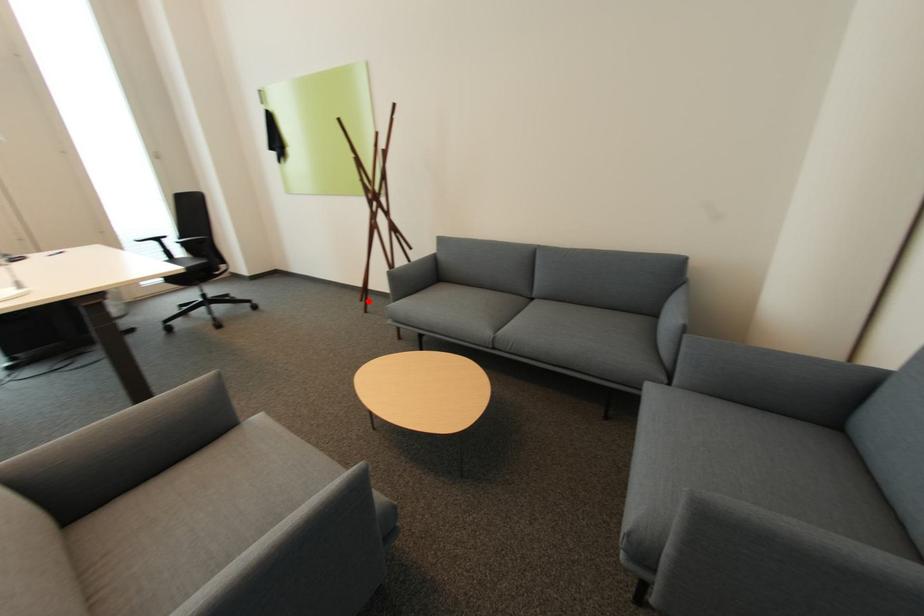
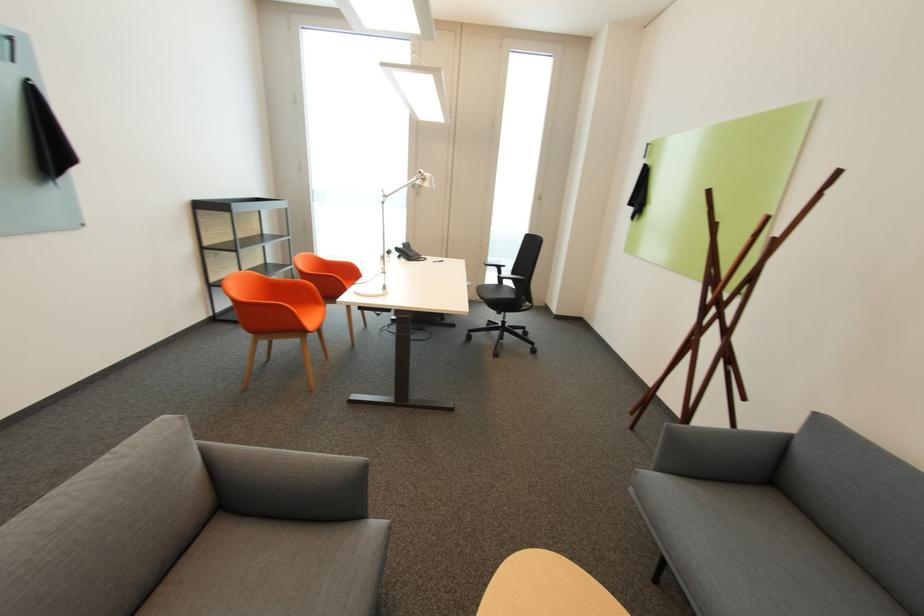
Question: A red point is marked in image1. In image2, is the corresponding 3D point closer to the camera or farther? Reply with the corresponding letter.

Choices:
 (A) The corresponding 3D point is closer.
 (B) The corresponding 3D point is farther.

Answer: (A)